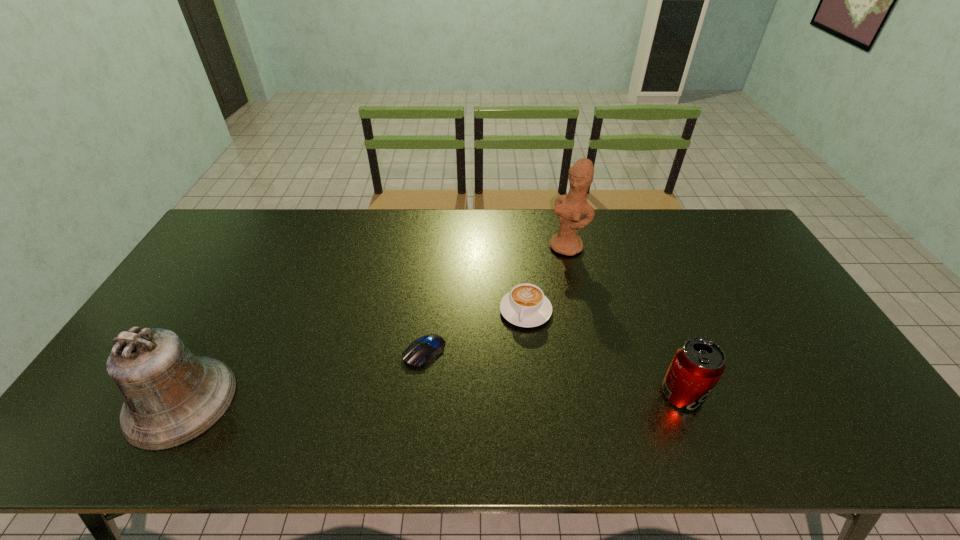
You are a GUI agent. You are given a task and a screenshot of the screen. Output one action in this format:
    pyautogui.click(x=<x>, y=<y>)
    Task: Click on the free space located 0.060m on the front-facing side of the farthest object
    Image resolution: width=960 pixels, height=540 pixels.
    Given the screenshot: What is the action you would take?
    pyautogui.click(x=547, y=266)

Identify the location of object positioned at the far edge. This screenshot has height=540, width=960. (x=570, y=208).

Locate an element on the screen. bell at the near edge is located at coordinates (171, 397).

Where is `soda can at the near edge`? The image size is (960, 540). soda can at the near edge is located at coordinates (699, 363).

Image resolution: width=960 pixels, height=540 pixels. What are the coordinates of `object positioned at the left edge` in the screenshot? It's located at (171, 397).

You are a GUI agent. You are given a task and a screenshot of the screen. Output one action in this format:
    pyautogui.click(x=<x>, y=<y>)
    Task: Click on the object situated at the near left corner
    This screenshot has height=540, width=960.
    Given the screenshot: What is the action you would take?
    (x=171, y=397)

Locate an element on the screen. blank space at the far edge of the desktop is located at coordinates click(528, 247).

The image size is (960, 540). In the image, there is a desktop. What are the coordinates of `vacant space at the near edge` in the screenshot? It's located at click(440, 388).

Where is `vacant space at the left edge of the desktop`? Image resolution: width=960 pixels, height=540 pixels. vacant space at the left edge of the desktop is located at coordinates (169, 321).

This screenshot has width=960, height=540. What are the coordinates of `free space at the far left corner of the desktop` in the screenshot? It's located at click(241, 229).